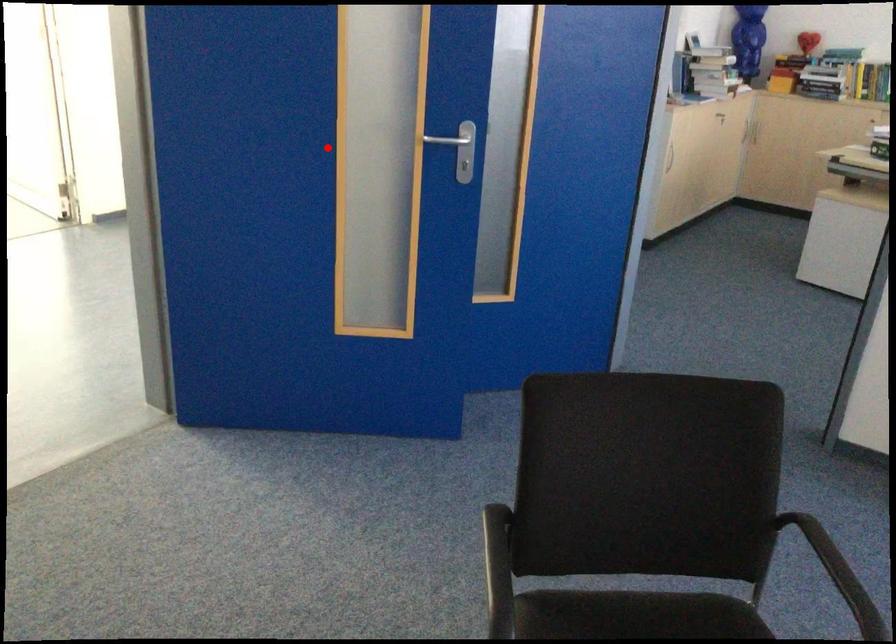
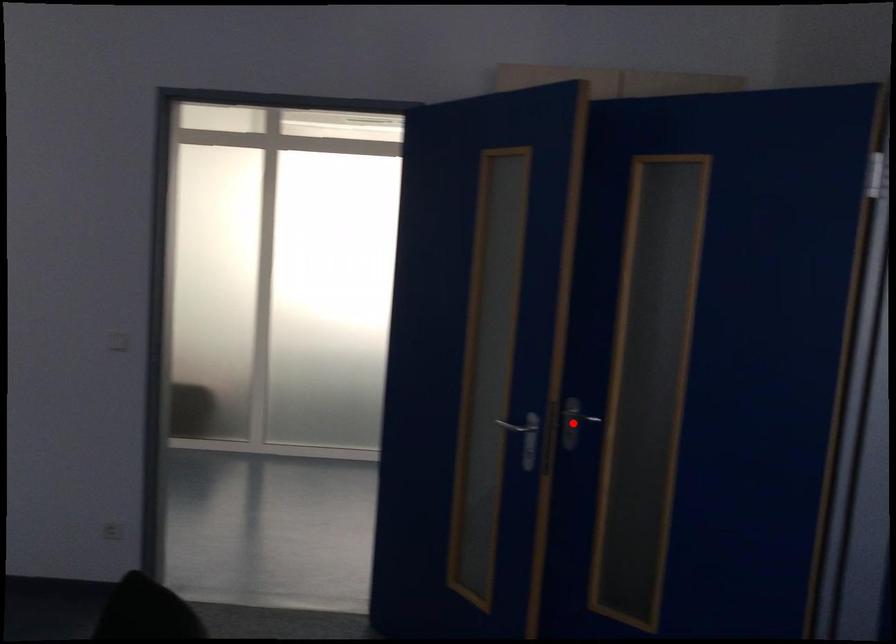
I am providing you with two images of the same scene from different viewpoints. A red point is marked on the first image and another point is marked on the second image. Is the red point in image1 aligned with the point shown in image2?

Yes